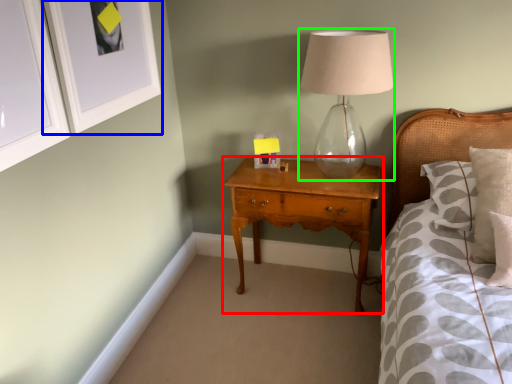
Question: Which object is positioned closest to nightstand (highlighted by a red box)? Select from picture frame (highlighted by a blue box) and table lamp (highlighted by a green box).

Choices:
 (A) picture frame
 (B) table lamp

Answer: (B)